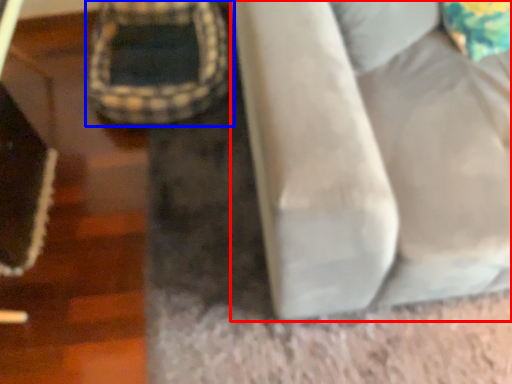
Question: Which of the following is the closest to the observer, furniture (highlighted by a red box) or bean bag chair (highlighted by a blue box)?

Choices:
 (A) furniture
 (B) bean bag chair

Answer: (A)